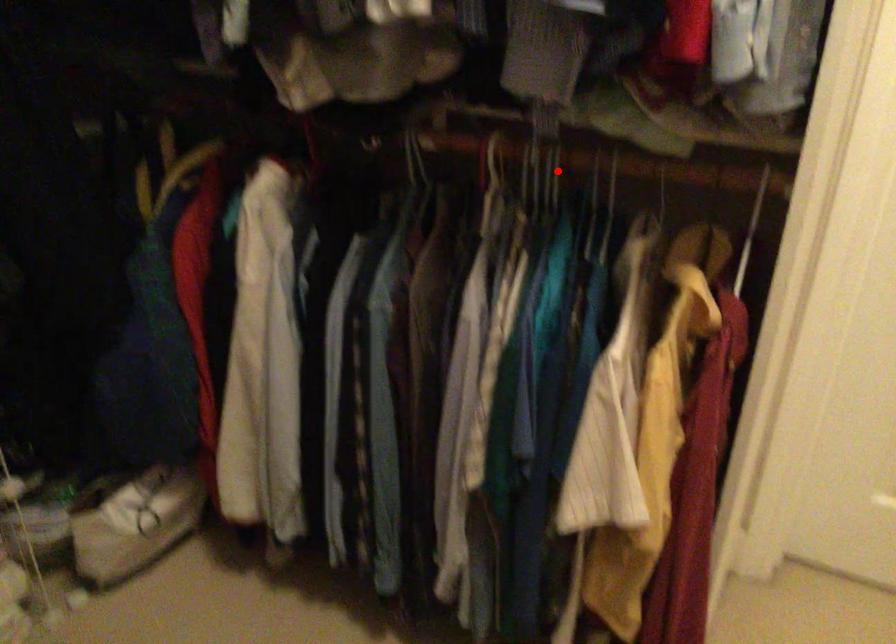
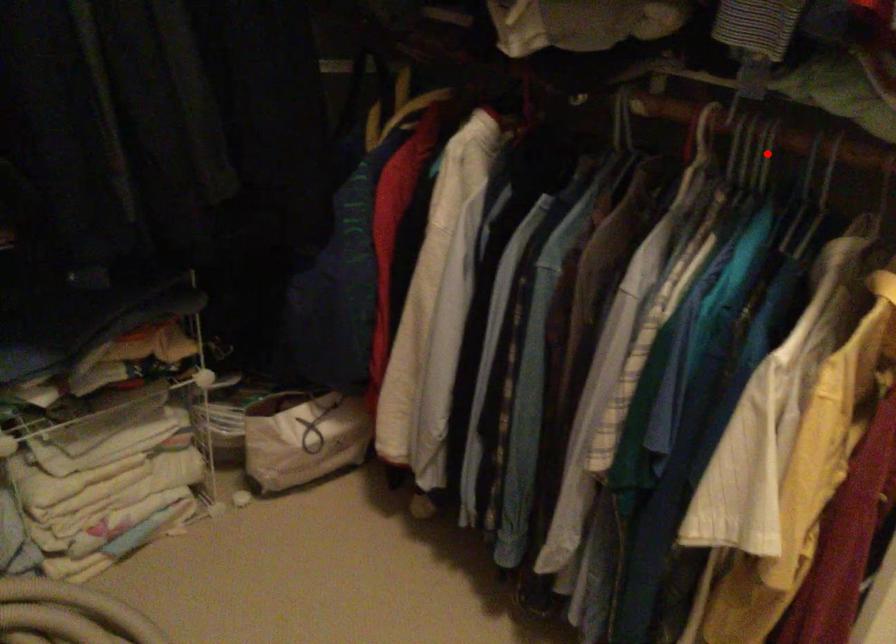
I am providing you with two images of the same scene from different viewpoints. A red point is marked on the first image and another point is marked on the second image. Does the point marked in image1 correspond to the same location as the one in image2?

Yes